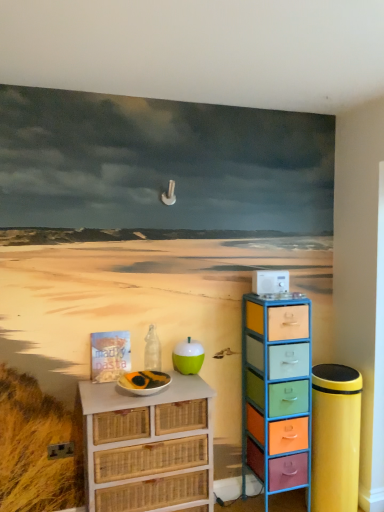
Question: Does white wicker chest of drawers at lower left, the second chest of drawers from the right, turn towards transparent glass bottle at center?

Choices:
 (A) yes
 (B) no

Answer: (B)

Question: From the image's perspective, is white wicker chest of drawers at lower left, which is the first chest of drawers from left to right, on top of transparent glass bottle at center?

Choices:
 (A) no
 (B) yes

Answer: (A)

Question: Can you confirm if white wicker chest of drawers at lower left, which is the first chest of drawers from left to right, is thinner than transparent glass bottle at center?

Choices:
 (A) no
 (B) yes

Answer: (A)

Question: Is white wicker chest of drawers at lower left, the second chest of drawers from the right, next to transparent glass bottle at center?

Choices:
 (A) yes
 (B) no

Answer: (B)

Question: From a real-world perspective, is white wicker chest of drawers at lower left, the second chest of drawers from the right, positioned over transparent glass bottle at center based on gravity?

Choices:
 (A) no
 (B) yes

Answer: (A)

Question: Considering their positions, is multicolored plastic drawers at right, the first chest of drawers when ordered from right to left, located in front of or behind teal glossy apple at center?

Choices:
 (A) front
 (B) behind

Answer: (A)

Question: Visually, is multicolored plastic drawers at right, the first chest of drawers when ordered from right to left, positioned to the left or to the right of teal glossy apple at center?

Choices:
 (A) left
 (B) right

Answer: (B)

Question: Based on their sizes in the image, would you say multicolored plastic drawers at right, which is counted as the second chest of drawers, starting from the left, is bigger or smaller than teal glossy apple at center?

Choices:
 (A) big
 (B) small

Answer: (A)

Question: Is multicolored plastic drawers at right, which is counted as the second chest of drawers, starting from the left, inside or outside of teal glossy apple at center?

Choices:
 (A) outside
 (B) inside

Answer: (A)

Question: Looking at the image, does multicolored plastic drawers at right, the first chest of drawers when ordered from right to left, seem bigger or smaller compared to transparent glass bottle at center?

Choices:
 (A) small
 (B) big

Answer: (B)

Question: Visually, is multicolored plastic drawers at right, which is counted as the second chest of drawers, starting from the left, positioned to the left or to the right of transparent glass bottle at center?

Choices:
 (A) right
 (B) left

Answer: (A)

Question: In terms of height, does multicolored plastic drawers at right, the first chest of drawers when ordered from right to left, look taller or shorter compared to transparent glass bottle at center?

Choices:
 (A) short
 (B) tall

Answer: (B)

Question: Is multicolored plastic drawers at right, which is counted as the second chest of drawers, starting from the left, inside the boundaries of transparent glass bottle at center, or outside?

Choices:
 (A) outside
 (B) inside

Answer: (A)

Question: Is multicolored plastic drawers at right, the first chest of drawers when ordered from right to left, inside the boundaries of white wicker chest of drawers at lower left, which is the first chest of drawers from left to right, or outside?

Choices:
 (A) inside
 (B) outside

Answer: (B)

Question: From the image's perspective, relative to white wicker chest of drawers at lower left, the second chest of drawers from the right, is multicolored plastic drawers at right, which is counted as the second chest of drawers, starting from the left, above or below?

Choices:
 (A) below
 (B) above

Answer: (B)